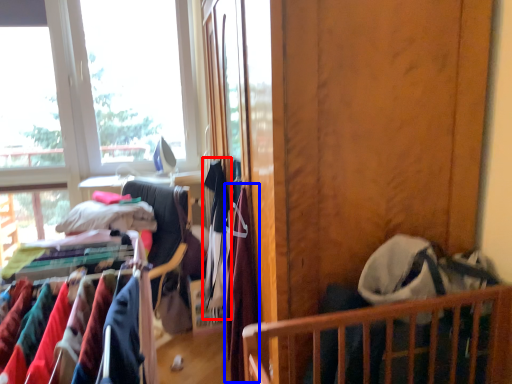
Question: Among these objects, which one is farthest to the camera, clothing (highlighted by a red box) or clothing (highlighted by a blue box)?

Choices:
 (A) clothing
 (B) clothing

Answer: (A)